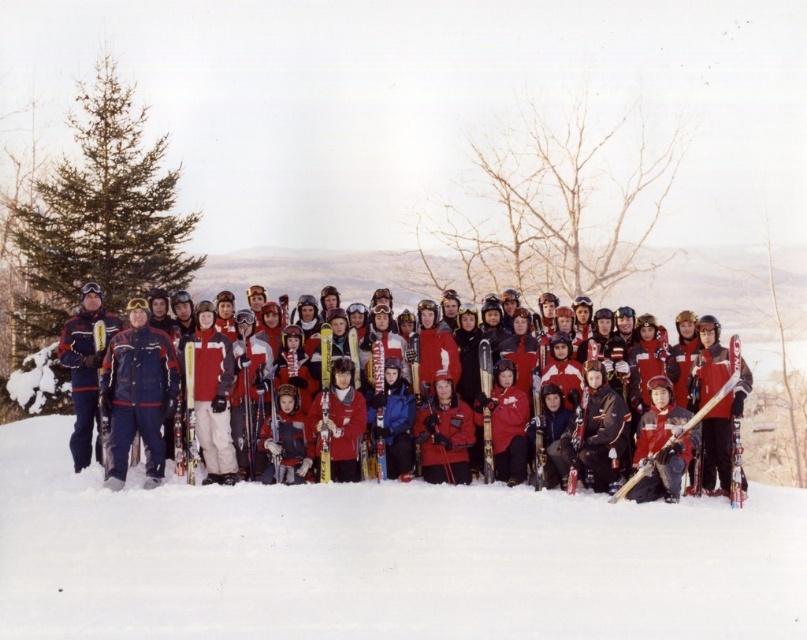
Does matte red skis at center appear under matte red jacket at center?

Indeed, matte red skis at center is positioned under matte red jacket at center.

Is matte red skis at center positioned before matte red jacket at center?

Yes, it is in front of matte red jacket at center.

Where is `matte red skis at center`? The image size is (807, 640). matte red skis at center is located at coordinates (381, 557).